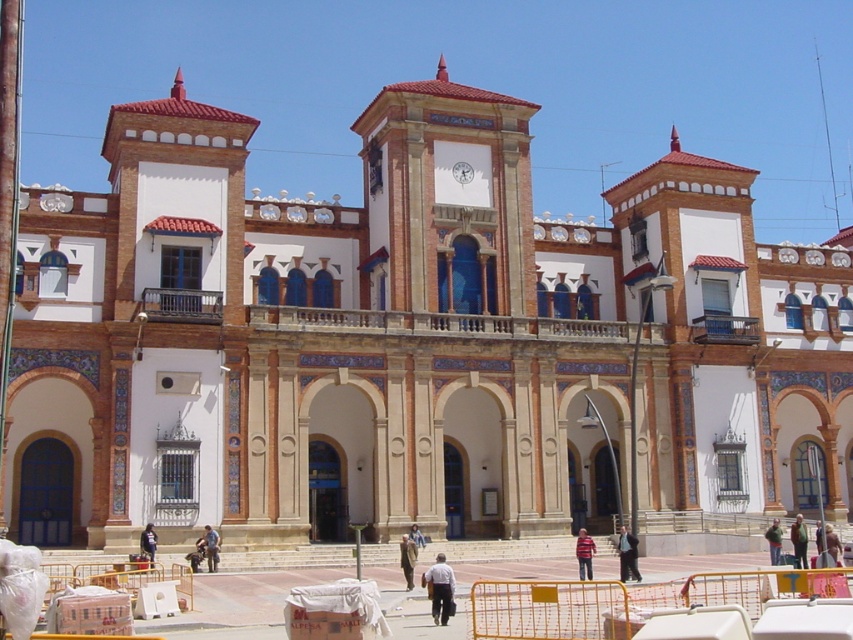
You are standing in front of the Spanish colonial building and want to determine the relative positions of two points on its facade. The first point is located at coordinates point (621, 532), and the second at point (796, 557). Which point is closer to you?

Point (621, 532) is closer to you because it is further to the viewer than point (796, 557).

You are an event organizer planning a photoshoot in front of the grand Spanish colonial building. You need to position two models wearing the dark suit at lower right and green fabric jacket at center. Considering their clothing heights, which model should stand closer to the central clock face to balance the composition?

The dark suit at lower right has a greater height compared to the green fabric jacket at center. To balance the composition, the taller model in the dark suit at lower right should stand closer to the central clock face, while the shorter model in the green fabric jacket at center can be positioned slightly further back.

You are standing in front of the grand Spanish colonial building. You see a white cotton shirt at center. Where exactly is the white cotton shirt located in relation to the central clock face?

The white cotton shirt at center is located at coordinates approximately 0.922 along the horizontal axis and 0.516 along the vertical axis relative to the central clock face.